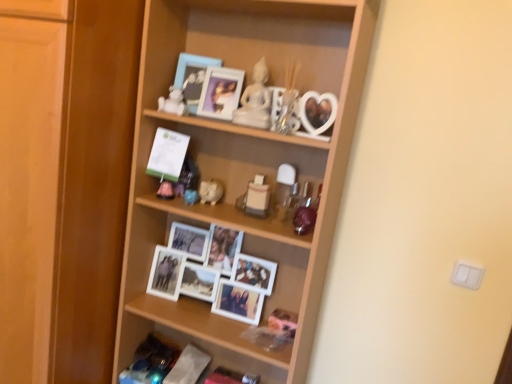
Question: Which direction should I rotate to look at wooden shelf at center, marked as the second shelf in a bottom-to-top arrangement, — up or down?

Choices:
 (A) down
 (B) up

Answer: (A)

Question: Is matte plastic picture frame at upper center, marked as the second picture frame in a left-to-right arrangement, outside white glossy statue at upper center, the 5th toy positioned from the bottom?

Choices:
 (A) no
 (B) yes

Answer: (B)

Question: Is matte plastic picture frame at upper center, marked as the second picture frame in a left-to-right arrangement, aimed at white glossy statue at upper center, the 5th toy positioned from the bottom?

Choices:
 (A) yes
 (B) no

Answer: (B)

Question: From the image's perspective, is matte plastic picture frame at upper center, marked as the second picture frame in a left-to-right arrangement, located beneath white glossy statue at upper center, which is counted as the 1th toy, starting from the top?

Choices:
 (A) no
 (B) yes

Answer: (A)

Question: Does matte plastic picture frame at upper center, which is counted as the 1th picture frame, starting from the right, lie behind white glossy statue at upper center, which is counted as the 1th toy, starting from the top?

Choices:
 (A) yes
 (B) no

Answer: (A)

Question: Does matte plastic picture frame at upper center, marked as the second picture frame in a left-to-right arrangement, have a smaller size compared to white glossy statue at upper center, which is counted as the 1th toy, starting from the top?

Choices:
 (A) yes
 (B) no

Answer: (B)

Question: Does matte plastic picture frame at upper center, marked as the second picture frame in a left-to-right arrangement, have a greater width compared to white glossy statue at upper center, which is counted as the 1th toy, starting from the top?

Choices:
 (A) yes
 (B) no

Answer: (A)

Question: Is matte blue picture frame at upper center, which is the second picture frame from right to left, far away from matte plastic picture frame at upper center, marked as the second picture frame in a left-to-right arrangement?

Choices:
 (A) no
 (B) yes

Answer: (A)

Question: Is the depth of matte blue picture frame at upper center, the 1th picture frame from the left, greater than that of matte plastic picture frame at upper center, which is counted as the 1th picture frame, starting from the right?

Choices:
 (A) no
 (B) yes

Answer: (B)

Question: Does matte blue picture frame at upper center, the 1th picture frame from the left, turn towards matte plastic picture frame at upper center, marked as the second picture frame in a left-to-right arrangement?

Choices:
 (A) yes
 (B) no

Answer: (B)

Question: Is matte blue picture frame at upper center, the 1th picture frame from the left, wider than matte plastic picture frame at upper center, marked as the second picture frame in a left-to-right arrangement?

Choices:
 (A) yes
 (B) no

Answer: (B)

Question: Is matte blue picture frame at upper center, which is the second picture frame from right to left, at the right side of matte plastic picture frame at upper center, marked as the second picture frame in a left-to-right arrangement?

Choices:
 (A) yes
 (B) no

Answer: (B)

Question: Is matte plastic picture frame at upper center, marked as the second picture frame in a left-to-right arrangement, inside matte blue picture frame at upper center, the 1th picture frame from the left?

Choices:
 (A) no
 (B) yes

Answer: (A)

Question: Can wooden shelf at center, which is counted as the 1th shelf, starting from the top, be found inside matte blue picture frame at upper center, the 1th picture frame from the left?

Choices:
 (A) yes
 (B) no

Answer: (B)